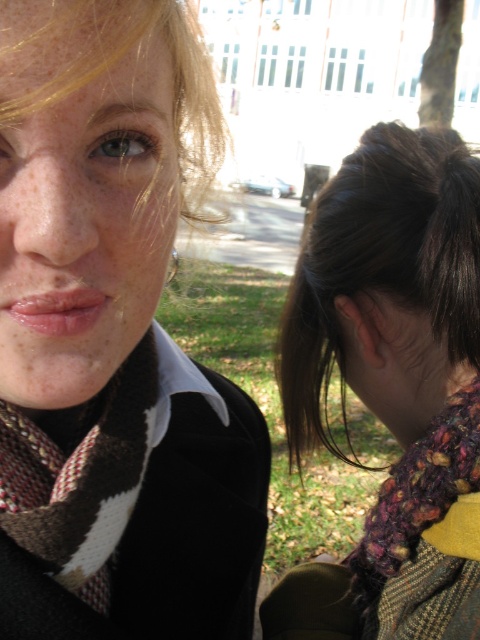
Question: Does matte brown scarf at upper left come behind brown and white knitted scarf at left?

Choices:
 (A) no
 (B) yes

Answer: (A)

Question: Which object appears closest to the camera in this image?

Choices:
 (A) brown and white knitted scarf at left
 (B) matte brown scarf at upper left
 (C) knitted multicolor scarf at lower right

Answer: (B)

Question: Does multicolored knitted scarf at left appear over matte brown scarf at upper left?

Choices:
 (A) no
 (B) yes

Answer: (A)

Question: Is brown and white knitted scarf at left closer to the viewer compared to knitted multicolor scarf at lower right?

Choices:
 (A) no
 (B) yes

Answer: (B)

Question: Considering the real-world distances, which object is farthest from the matte brown scarf at upper left?

Choices:
 (A) brown and white knitted scarf at left
 (B) knitted multicolored scarf at lower right

Answer: (B)

Question: Among these points, which one is farthest from the camera?

Choices:
 (A) (471, 468)
 (B) (142, 460)

Answer: (A)